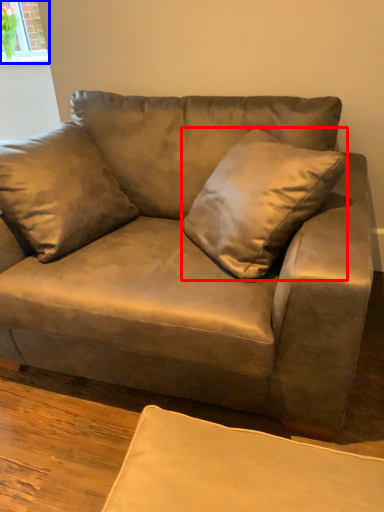
Question: Which object is further to the camera taking this photo, throw pillow (highlighted by a red box) or window (highlighted by a blue box)?

Choices:
 (A) throw pillow
 (B) window

Answer: (B)